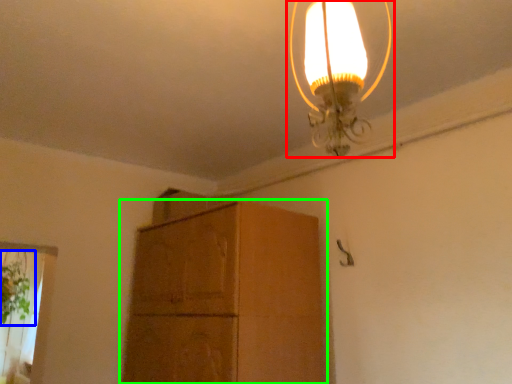
Question: Which object is positioned closest to lamp (highlighted by a red box)? Select from plant (highlighted by a blue box) and cabinetry (highlighted by a green box).

Choices:
 (A) plant
 (B) cabinetry

Answer: (B)